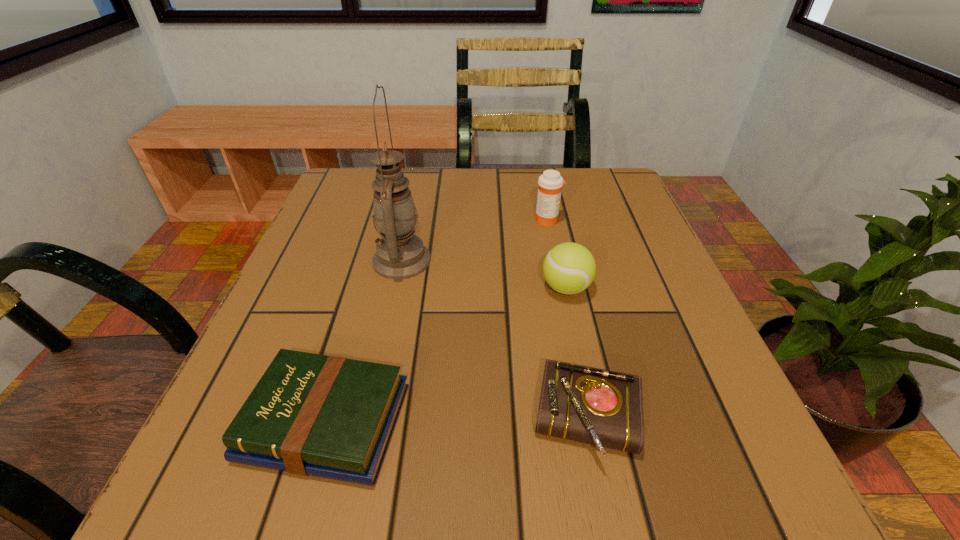
I want to click on vacant area between the tallest object and the diary, so click(495, 341).

Find the location of a particular element. The width and height of the screenshot is (960, 540). free space between the tallest object and the tennis ball is located at coordinates (484, 274).

Where is `empty space between the book and the fourth shortest object`? empty space between the book and the fourth shortest object is located at coordinates (437, 321).

At what (x,y) coordinates should I click in order to perform the action: click on empty space between the book and the tallest object. Please return your answer as a coordinate pair (x, y). This screenshot has height=540, width=960. Looking at the image, I should click on (364, 341).

Image resolution: width=960 pixels, height=540 pixels. Identify the location of the fourth closest object relative to the second tallest object. (326, 416).

Find the location of a particular element. The width and height of the screenshot is (960, 540). the second closest object to the oil lamp is located at coordinates (569, 268).

In order to click on vacant point that satisfies the following two spatial constraints: 1. on the back side of the oil lamp; 2. on the right side of the book in this screenshot , I will do `click(372, 260)`.